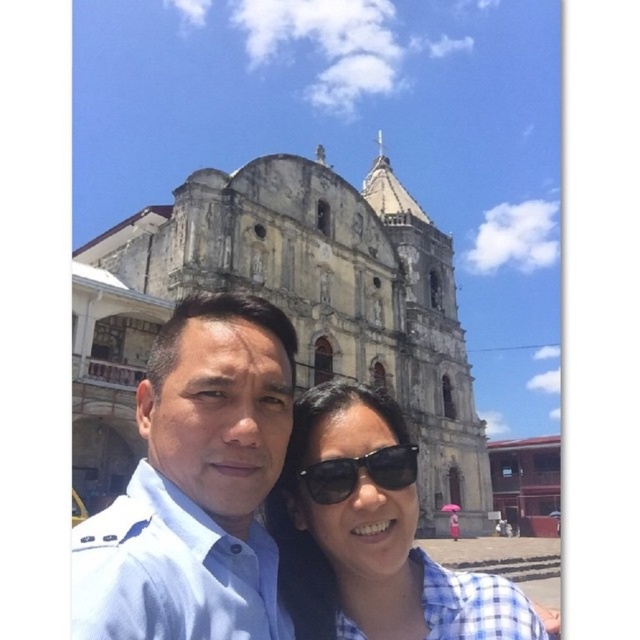
You are planning to take a group photo with both the matte blue shirt at center and the checkered fabric shirt at center. If you want to ensure both shirts are visible in the frame, which shirt should be positioned closer to the camera to maintain visibility?

The matte blue shirt at center is wider than the checkered fabric shirt at center. To ensure both shirts are visible in the frame, the wider matte blue shirt at center should be positioned closer to the camera so that its larger size doesn

You are taking a photo of the stone church at center and the black plastic sunglasses at center. Which object will appear larger in your photo?

The stone church at center is bigger than the black plastic sunglasses at center, so it will appear larger in the photo.

You are taking a photo in front of the historic church. You want to ensure the matte blue shirt at center is centered in the frame. Given its current position at point coordinates, is it already centered?

The matte blue shirt at center is already centered because its position at point coordinates is labeled as being at center.